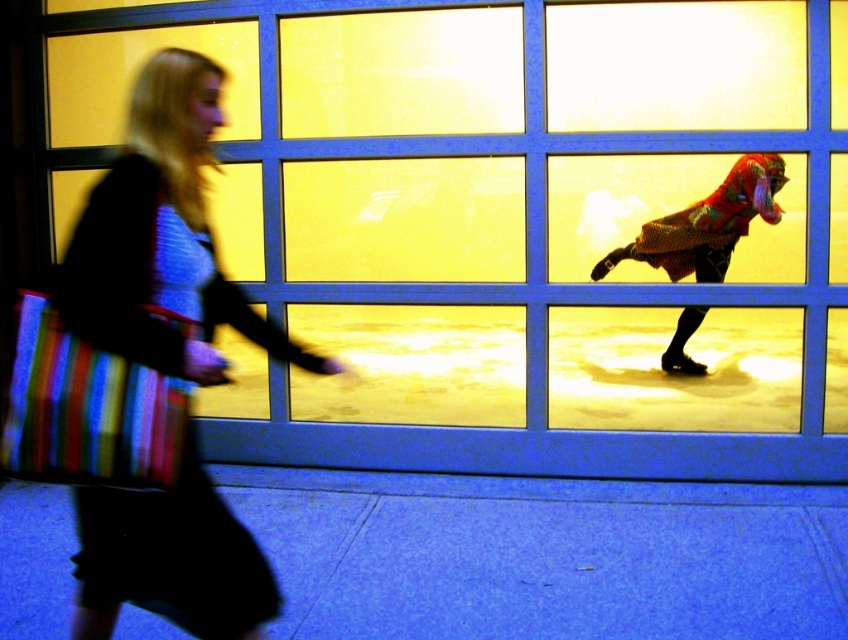
You are standing in the urban scene and want to locate the point at coordinates point (500,224). According to the scene description, where is this point located?

The point (500,224) is on the yellow glass window at center.

In the scene shown: You are a delivery person trying to park your shiny metallic figure at right on the blue smooth pavement at lower center. Can you park it there?

The blue smooth pavement at lower center is located below the shiny metallic figure at right, so the pavement is not accessible for parking the vehicle.